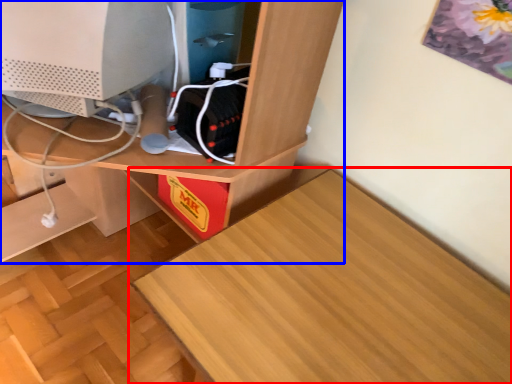
Question: Which object appears closest to the camera in this image, table (highlighted by a red box) or desk (highlighted by a blue box)?

Choices:
 (A) table
 (B) desk

Answer: (B)